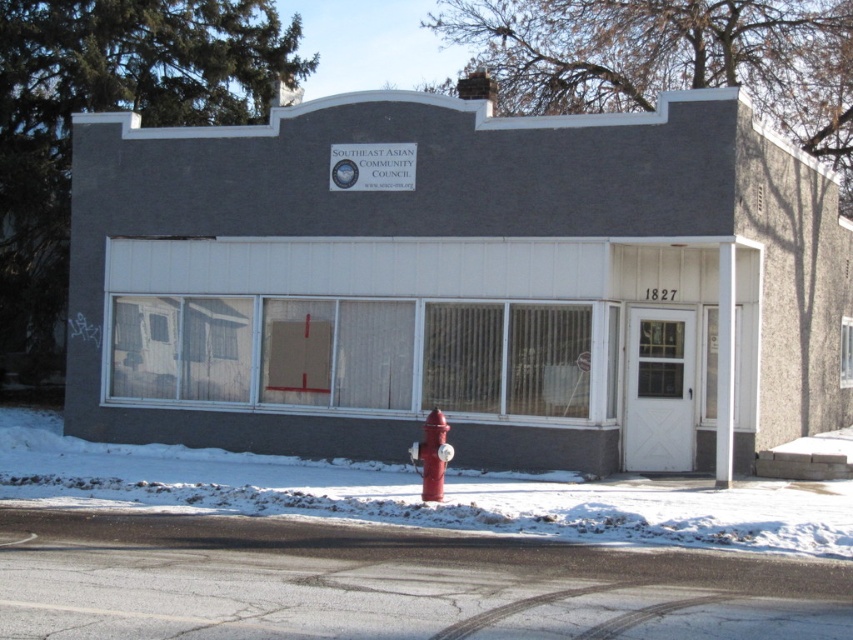
Which is below, white powdery snow at lower center or red matte fire hydrant at lower center?

white powdery snow at lower center is lower down.

Is the position of white powdery snow at lower center less distant than that of red matte fire hydrant at lower center?

Yes, white powdery snow at lower center is closer to the viewer.

Is point (845, 483) closer to camera compared to point (433, 486)?

No, (845, 483) is behind (433, 486).

The height and width of the screenshot is (640, 853). I want to click on white powdery snow at lower center, so click(418, 493).